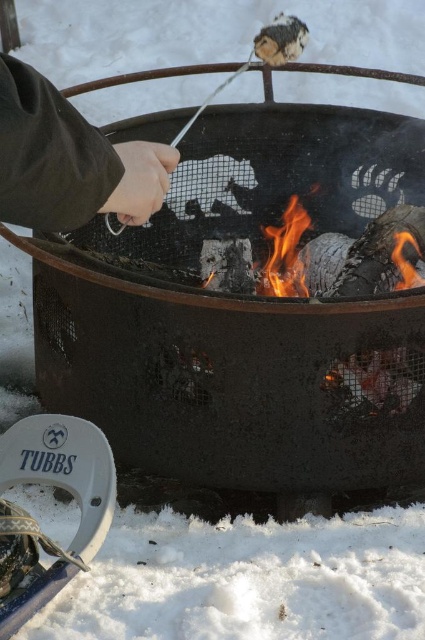
Question: Which point is farther from the camera taking this photo?

Choices:
 (A) (36, 216)
 (B) (294, 228)
 (C) (116, 349)

Answer: (B)

Question: Can you confirm if rusty metal grill at center is positioned below flameliquid/gas at center?

Choices:
 (A) yes
 (B) no

Answer: (A)

Question: Which point is farther from the camera taking this photo?

Choices:
 (A) (350, 444)
 (B) (269, 262)

Answer: (B)

Question: Which of these objects is positioned farthest from the flameliquid/gas at center?

Choices:
 (A) dark green fabric at upper left
 (B) rusty metal grill at center

Answer: (A)

Question: Does rusty metal grill at center have a greater width compared to flameliquid/gas at center?

Choices:
 (A) no
 (B) yes

Answer: (B)

Question: Can you confirm if rusty metal grill at center is positioned to the right of flameliquid/gas at center?

Choices:
 (A) yes
 (B) no

Answer: (B)